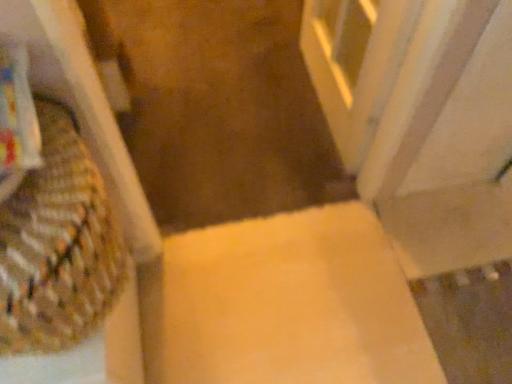
The height and width of the screenshot is (384, 512). What do you see at coordinates (218, 108) in the screenshot? I see `yellow carpet at center` at bounding box center [218, 108].

You are a GUI agent. You are given a task and a screenshot of the screen. Output one action in this format:
    pyautogui.click(x=<x>, y=<y>)
    Task: Click on the woven fabric basket at left
    
    Given the screenshot: What is the action you would take?
    pyautogui.click(x=58, y=246)

The height and width of the screenshot is (384, 512). Identify the location of matte yellow cardboard box at center. (274, 307).

Describe the element at coordinates (355, 64) in the screenshot. The height and width of the screenshot is (384, 512). I see `white marble screen door at upper right` at that location.

Locate an element on the screen. The image size is (512, 384). yellow carpet at center is located at coordinates (218, 108).

Considering the relative sizes of matte yellow cardboard box at center and yellow carpet at center in the image provided, is matte yellow cardboard box at center taller than yellow carpet at center?

Yes.

What's the angular difference between matte yellow cardboard box at center and yellow carpet at center's facing directions?

90.9 degrees separate the facing orientations of matte yellow cardboard box at center and yellow carpet at center.

Considering the positions of objects matte yellow cardboard box at center and yellow carpet at center in the image provided, who is behind, matte yellow cardboard box at center or yellow carpet at center?

yellow carpet at center.

Which is behind, point (244, 251) or point (238, 115)?

The point (238, 115) is more distant.

What's the angular difference between woven fabric basket at left and white marble screen door at upper right's facing directions?

The angular difference between woven fabric basket at left and white marble screen door at upper right is 94.7 degrees.

From a real-world perspective, is woven fabric basket at left under white marble screen door at upper right?

Incorrect, from a real-world perspective, woven fabric basket at left is higher than white marble screen door at upper right.

Considering the sizes of woven fabric basket at left and white marble screen door at upper right in the image, is woven fabric basket at left wider or thinner than white marble screen door at upper right?

In the image, woven fabric basket at left appears to be wider than white marble screen door at upper right.

Does woven fabric basket at left come behind white marble screen door at upper right?

That is False.

From a real-world perspective, is white marble screen door at upper right above or below woven fabric basket at left?

white marble screen door at upper right is below woven fabric basket at left.

From the image's perspective, between white marble screen door at upper right and woven fabric basket at left, who is located below?

woven fabric basket at left is shown below in the image.

Is white marble screen door at upper right bigger or smaller than woven fabric basket at left?

Considering their sizes, white marble screen door at upper right takes up more space than woven fabric basket at left.

How many degrees apart are the facing directions of white marble screen door at upper right and woven fabric basket at left?

white marble screen door at upper right and woven fabric basket at left are facing 94.7 degrees away from each other.

Considering the relative sizes of matte yellow cardboard box at center and woven fabric basket at left in the image provided, is matte yellow cardboard box at center shorter than woven fabric basket at left?

Correct, matte yellow cardboard box at center is not as tall as woven fabric basket at left.

From a real-world perspective, relative to woven fabric basket at left, is matte yellow cardboard box at center vertically above or below?

From a real-world perspective, matte yellow cardboard box at center is physically below woven fabric basket at left.

Considering the sizes of matte yellow cardboard box at center and woven fabric basket at left in the image, is matte yellow cardboard box at center wider or thinner than woven fabric basket at left?

matte yellow cardboard box at center is wider than woven fabric basket at left.

From the image's perspective, which object appears higher, woven fabric basket at left or matte yellow cardboard box at center?

woven fabric basket at left, from the image's perspective.

From the picture: Considering the positions of objects woven fabric basket at left and matte yellow cardboard box at center in the image provided, who is more to the left, woven fabric basket at left or matte yellow cardboard box at center?

From the viewer's perspective, woven fabric basket at left appears more on the left side.

Is woven fabric basket at left surrounding matte yellow cardboard box at center?

Definitely not — matte yellow cardboard box at center is not inside woven fabric basket at left.

Relative to yellow carpet at center, is woven fabric basket at left in front or behind?

woven fabric basket at left is positioned closer to the viewer than yellow carpet at center.

Is point (25, 309) behind point (280, 176)?

No, (25, 309) is in front of (280, 176).

Is woven fabric basket at left positioned with its back to yellow carpet at center?

Absolutely, woven fabric basket at left is directed away from yellow carpet at center.

Who is taller, woven fabric basket at left or yellow carpet at center?

Standing taller between the two is woven fabric basket at left.

Considering the positions of objects yellow carpet at center and white marble screen door at upper right in the image provided, who is more to the right, yellow carpet at center or white marble screen door at upper right?

Positioned to the right is white marble screen door at upper right.

Looking at this image, from a real-world perspective, is yellow carpet at center physically above white marble screen door at upper right?

Actually, yellow carpet at center is physically below white marble screen door at upper right in the real world.

In the scene shown: Does yellow carpet at center contain white marble screen door at upper right?

No, white marble screen door at upper right is located outside of yellow carpet at center.

How different are the orientations of yellow carpet at center and white marble screen door at upper right in degrees?

They differ by 91.7 degrees in their facing directions.

Find the location of a particular element. This screenshot has width=512, height=384. aisle lying behind the matte yellow cardboard box at center is located at coordinates (218, 108).

Locate an element on the screen. The width and height of the screenshot is (512, 384). screen door below the woven fabric basket at left (from a real-world perspective) is located at coordinates (355, 64).

When comparing their distances from woven fabric basket at left, does matte yellow cardboard box at center or yellow carpet at center seem closer?

matte yellow cardboard box at center.

Which object lies nearer to the anchor point yellow carpet at center, woven fabric basket at left or matte yellow cardboard box at center?

The object closer to yellow carpet at center is matte yellow cardboard box at center.

Estimate the real-world distances between objects in this image. Which object is closer to yellow carpet at center, matte yellow cardboard box at center or white marble screen door at upper right?

Among the two, white marble screen door at upper right is located nearer to yellow carpet at center.

Considering their positions, is white marble screen door at upper right positioned closer to woven fabric basket at left than matte yellow cardboard box at center?

The object closer to woven fabric basket at left is matte yellow cardboard box at center.

Looking at the image, which one is located closer to matte yellow cardboard box at center, white marble screen door at upper right or yellow carpet at center?

yellow carpet at center lies closer to matte yellow cardboard box at center than the other object.

Which object lies nearer to the anchor point yellow carpet at center, matte yellow cardboard box at center or woven fabric basket at left?

Among the two, matte yellow cardboard box at center is located nearer to yellow carpet at center.

Based on their spatial positions, is matte yellow cardboard box at center or woven fabric basket at left further from white marble screen door at upper right?

woven fabric basket at left.

Estimate the real-world distances between objects in this image. Which object is closer to white marble screen door at upper right, yellow carpet at center or woven fabric basket at left?

Among the two, yellow carpet at center is located nearer to white marble screen door at upper right.

Image resolution: width=512 pixels, height=384 pixels. Find the location of `screen door between woven fabric basket at left and yellow carpet at center in the front-back direction`. screen door between woven fabric basket at left and yellow carpet at center in the front-back direction is located at coordinates (355, 64).

Locate an element on the screen. This screenshot has width=512, height=384. cardboard box between woven fabric basket at left and yellow carpet at center along the z-axis is located at coordinates (274, 307).

The image size is (512, 384). What are the coordinates of `aisle between white marble screen door at upper right and matte yellow cardboard box at center vertically` in the screenshot? It's located at (218, 108).

Identify the location of basket between white marble screen door at upper right and matte yellow cardboard box at center in the vertical direction. (58, 246).